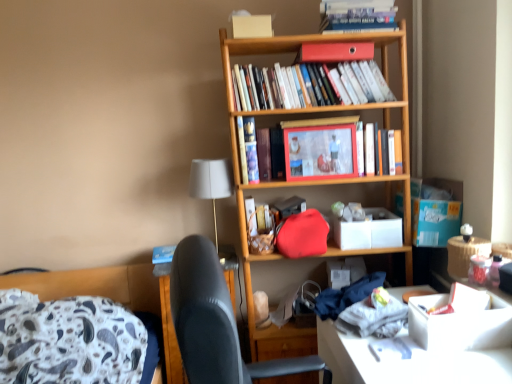
The width and height of the screenshot is (512, 384). Describe the element at coordinates (302, 234) in the screenshot. I see `matte red handbag at center` at that location.

Where is `hardcover book at center, the 3th book positioned from the top`? hardcover book at center, the 3th book positioned from the top is located at coordinates (248, 149).

What do you see at coordinates (381, 150) in the screenshot?
I see `hardcover book at center, which is the fourth book from top to bottom` at bounding box center [381, 150].

Describe the element at coordinates (308, 85) in the screenshot. The width and height of the screenshot is (512, 384). I see `hardcover books at upper center, placed as the 3th book when sorted from bottom to top` at that location.

Measure the distance between point (314, 45) and camera.

Point (314, 45) and camera are 6.00 feet apart.

Identify the location of hardcover book at upper center, the fourth book ordered from the bottom. (357, 15).

From a real-world perspective, is hardcover book at upper center, the fourth book ordered from the bottom, positioned over wooden picture frame at center based on gravity?

Yes, from a real-world perspective, hardcover book at upper center, the fourth book ordered from the bottom, is over wooden picture frame at center

Which point is more forward, (350, 11) or (354, 148)?

The point (350, 11) is in front.

Would you say white fabric lampshade at upper center is a long distance from white cardboard box at center-right, arranged as the 2th cardboard box when viewed from the right?

white fabric lampshade at upper center is near white cardboard box at center-right, arranged as the 2th cardboard box when viewed from the right, not far away.

From the picture: From a real-world perspective, is white fabric lampshade at upper center over white cardboard box at center-right, arranged as the 2th cardboard box when viewed from the right?

Yes, from a real-world perspective, white fabric lampshade at upper center is above white cardboard box at center-right, arranged as the 2th cardboard box when viewed from the right.

Considering the points (215, 160) and (375, 225), which point is behind, point (215, 160) or point (375, 225)?

Positioned behind is point (375, 225).

Are hardcover book at upper center, the fourth book ordered from the bottom, and hardcover book at center, which is the second book from bottom to top, making contact?

No, hardcover book at upper center, the fourth book ordered from the bottom, is not beside hardcover book at center, which is the second book from bottom to top.

Is hardcover book at upper center, the fourth book ordered from the bottom, further to camera compared to hardcover book at center, which is the second book from bottom to top?

No, it is not.

Is hardcover book at upper center, arranged as the first book when viewed from the top, not inside hardcover book at center, which is the second book from bottom to top?

Yes, hardcover book at upper center, arranged as the first book when viewed from the top, is located beyond the bounds of hardcover book at center, which is the second book from bottom to top.

From the image's perspective, is hardcover book at upper center, arranged as the first book when viewed from the top, located beneath hardcover book at center, the 3th book positioned from the top?

Incorrect, from the image's perspective, hardcover book at upper center, arranged as the first book when viewed from the top, is higher than hardcover book at center, the 3th book positioned from the top.

From the image's perspective, which is above, matte red book at upper center or blue cardboard box at right, positioned as the first cardboard box in right-to-left order?

matte red book at upper center, from the image's perspective.

Is matte red book at upper center directly adjacent to blue cardboard box at right, positioned as the first cardboard box in right-to-left order?

No, matte red book at upper center is not with blue cardboard box at right, positioned as the first cardboard box in right-to-left order.

What's the angular difference between matte red book at upper center and blue cardboard box at right, the second cardboard box positioned from the left,'s facing directions?

There is a 6.71-degree angle between the facing directions of matte red book at upper center and blue cardboard box at right, the second cardboard box positioned from the left.

Is point (320, 50) positioned after point (431, 185)?

No.

From the image's perspective, which object appears higher, hardcover books at upper center, placed as the 3th book when sorted from bottom to top, or matte red handbag at center?

hardcover books at upper center, placed as the 3th book when sorted from bottom to top, is shown above in the image.

This screenshot has height=384, width=512. What are the coordinates of `handbag located underneath the hardcover books at upper center, arranged as the 2th book when viewed from the top (from a real-world perspective)` in the screenshot? It's located at (302, 234).

Is hardcover books at upper center, arranged as the 2th book when viewed from the top, shorter than matte red handbag at center?

No.

From the picture: From the image's perspective, does white fabric lampshade at upper center appear lower than hardcover books at upper center, placed as the 3th book when sorted from bottom to top?

Yes.

Which is more to the left, white fabric lampshade at upper center or hardcover books at upper center, arranged as the 2th book when viewed from the top?

white fabric lampshade at upper center.

Is white fabric lampshade at upper center taller or shorter than hardcover books at upper center, placed as the 3th book when sorted from bottom to top?

white fabric lampshade at upper center is taller than hardcover books at upper center, placed as the 3th book when sorted from bottom to top.

Would you say white fabric lampshade at upper center is a long distance from hardcover books at upper center, arranged as the 2th book when viewed from the top?

white fabric lampshade at upper center is actually quite close to hardcover books at upper center, arranged as the 2th book when viewed from the top.

Would you say hardcover book at upper center, the fourth book ordered from the bottom, is inside or outside white fabric lampshade at upper center?

hardcover book at upper center, the fourth book ordered from the bottom, lies outside white fabric lampshade at upper center.

Is hardcover book at upper center, the fourth book ordered from the bottom, further to camera compared to white fabric lampshade at upper center?

No, hardcover book at upper center, the fourth book ordered from the bottom, is closer to the viewer.

From a real-world perspective, is hardcover book at upper center, arranged as the first book when viewed from the top, located higher than white fabric lampshade at upper center?

Yes, from a real-world perspective, hardcover book at upper center, arranged as the first book when viewed from the top, is above white fabric lampshade at upper center.

Identify the location of lamp that appears behind the hardcover book at upper center, arranged as the first book when viewed from the top. (211, 182).

The width and height of the screenshot is (512, 384). Identify the location of picture frame that appears below the hardcover book at upper center, arranged as the first book when viewed from the top (from a real-world perspective). (320, 152).

Image resolution: width=512 pixels, height=384 pixels. I want to click on the 1st cardboard box to the right when counting from the white fabric lampshade at upper center, so click(369, 230).

Which object lies further to the anchor point white fabric lampshade at upper center, hardcover book at upper center, arranged as the first book when viewed from the top, or hardcover book at center, the 3th book positioned from the top?

hardcover book at upper center, arranged as the first book when viewed from the top.

Based on their spatial positions, is matte red book at upper center or white cardboard box at lower right further from hardcover books at upper center, placed as the 3th book when sorted from bottom to top?

Among the two, white cardboard box at lower right is located further to hardcover books at upper center, placed as the 3th book when sorted from bottom to top.

Considering their positions, is white cardboard box at center-right, arranged as the 2th cardboard box when viewed from the right, positioned closer to matte red book at upper center than matte red handbag at center?

matte red handbag at center lies closer to matte red book at upper center than the other object.

Estimate the real-world distances between objects in this image. Which object is closer to hardcover book at center, the 1th book from the bottom, white cardboard box at lower right or blue cardboard box at right, positioned as the first cardboard box in right-to-left order?

blue cardboard box at right, positioned as the first cardboard box in right-to-left order, is closer to hardcover book at center, the 1th book from the bottom.

From the picture: When comparing their distances from blue cardboard box at right, positioned as the first cardboard box in right-to-left order, does hardcover book at center, the 3th book positioned from the top, or wooden picture frame at center seem further?

Among the two, hardcover book at center, the 3th book positioned from the top, is located further to blue cardboard box at right, positioned as the first cardboard box in right-to-left order.

Considering their positions, is blue cardboard box at right, the second cardboard box positioned from the left, positioned closer to white fabric lampshade at upper center than matte red book at upper center?

matte red book at upper center is closer to white fabric lampshade at upper center.

When comparing their distances from matte red handbag at center, does white cardboard box at center-right, the 1th cardboard box from the left, or blue cardboard box at right, the second cardboard box positioned from the left, seem closer?

Based on the image, white cardboard box at center-right, the 1th cardboard box from the left, appears to be nearer to matte red handbag at center.

Which object lies further to the anchor point hardcover book at center, which is the second book from bottom to top, hardcover book at upper center, arranged as the first book when viewed from the top, or matte red book at upper center?

hardcover book at upper center, arranged as the first book when viewed from the top.

Where is `cardboard box between matte red handbag at center and blue cardboard box at right, the second cardboard box positioned from the left, from left to right`? The image size is (512, 384). cardboard box between matte red handbag at center and blue cardboard box at right, the second cardboard box positioned from the left, from left to right is located at coordinates (369, 230).

Where is `handbag between matte red book at upper center and white cardboard box at lower right in the vertical direction`? The height and width of the screenshot is (384, 512). handbag between matte red book at upper center and white cardboard box at lower right in the vertical direction is located at coordinates (302, 234).

The image size is (512, 384). Find the location of `paperback book between hardcover book at upper center, the fourth book ordered from the bottom, and hardcover book at center, the 1th book from the bottom, in the vertical direction`. paperback book between hardcover book at upper center, the fourth book ordered from the bottom, and hardcover book at center, the 1th book from the bottom, in the vertical direction is located at coordinates (335, 52).

Locate an element on the screen. The width and height of the screenshot is (512, 384). lamp between white cardboard box at lower right and white cardboard box at center-right, arranged as the 2th cardboard box when viewed from the right, along the z-axis is located at coordinates (211, 182).